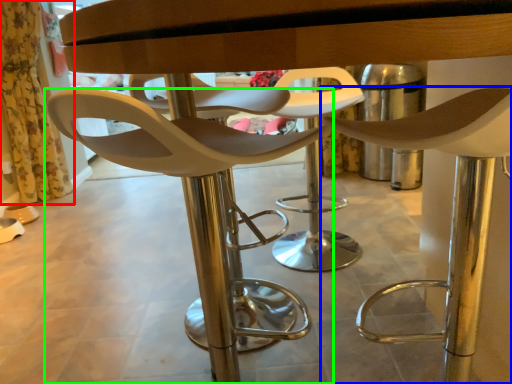
Question: Which object is positioned farthest from curtain (highlighted by a red box)? Select from chair (highlighted by a blue box) and chair (highlighted by a green box).

Choices:
 (A) chair
 (B) chair

Answer: (A)